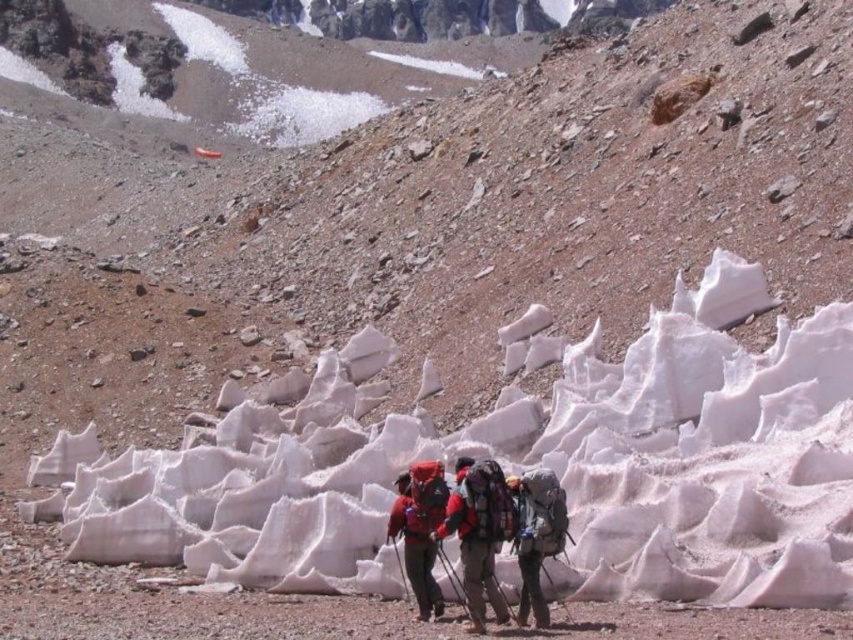
You are a photographer trying to capture both the red fabric jacket at center and the matte red jacket at center in a single frame. Which jacket will appear bigger in your photo?

The red fabric jacket at center will appear bigger in the photo since it is larger in size than the matte red jacket at center.

In the scene shown: You are a photographer planning to take a photo of the hikers in the mountainous terrain. You want to ensure that both the red fabric jacket at center and the matte gray backpack at center are clearly visible. Based on their sizes, which object should you focus on to ensure both are in frame?

The red fabric jacket at center is taller than the matte gray backpack at center. To ensure both are in frame, focus on the red fabric jacket at center since it is taller and will require a wider angle to capture both objects.